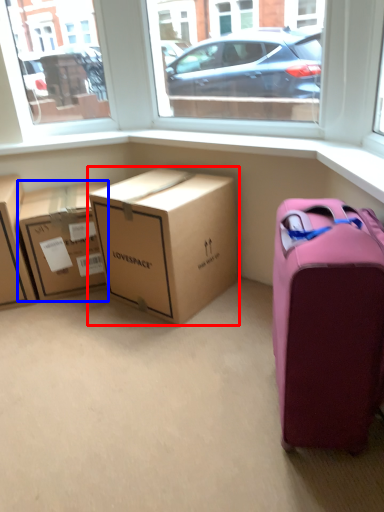
Question: Which object appears closest to the camera in this image, box (highlighted by a red box) or box (highlighted by a blue box)?

Choices:
 (A) box
 (B) box

Answer: (A)